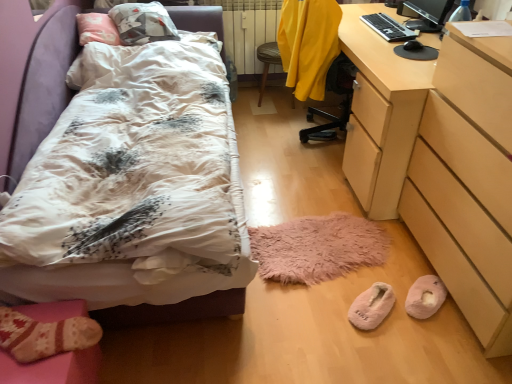
The width and height of the screenshot is (512, 384). Find the location of `empty space that is ontop of knitted wool socks at lower left (from a real-world perspective)`. empty space that is ontop of knitted wool socks at lower left (from a real-world perspective) is located at coordinates (42, 340).